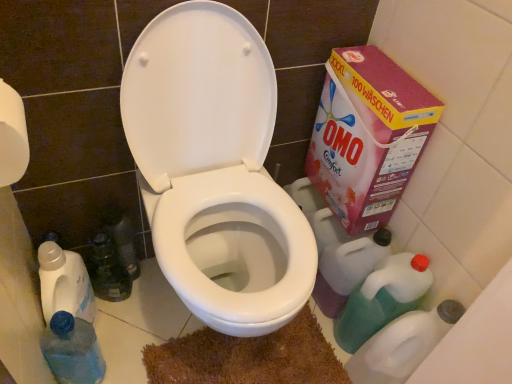
Question: Should I look upward or downward to see translucent plastic bottle at lower left?

Choices:
 (A) up
 (B) down

Answer: (B)

Question: Does green translucent bottle at lower right, the second cleaning product ordered from the bottom, come behind white glossy toilet at center?

Choices:
 (A) yes
 (B) no

Answer: (A)

Question: Is green translucent bottle at lower right, arranged as the first cleaning product when viewed from the top, outside of white glossy toilet at center?

Choices:
 (A) yes
 (B) no

Answer: (A)

Question: Is green translucent bottle at lower right, arranged as the first cleaning product when viewed from the top, smaller than white glossy toilet at center?

Choices:
 (A) no
 (B) yes

Answer: (B)

Question: From a real-world perspective, is green translucent bottle at lower right, the second cleaning product ordered from the bottom, over white glossy toilet at center?

Choices:
 (A) yes
 (B) no

Answer: (B)

Question: From the image's perspective, is green translucent bottle at lower right, the second cleaning product ordered from the bottom, over white glossy toilet at center?

Choices:
 (A) no
 (B) yes

Answer: (A)

Question: Is green translucent bottle at lower right, the second cleaning product ordered from the bottom, bigger than white glossy toilet at center?

Choices:
 (A) yes
 (B) no

Answer: (B)

Question: Is translucent plastic bottle at lower right, marked as the first cleaning product in a bottom-to-top arrangement, oriented away from pink cardboard box at right?

Choices:
 (A) yes
 (B) no

Answer: (B)

Question: Does translucent plastic bottle at lower right, placed as the 2th cleaning product when sorted from top to bottom, appear on the right side of pink cardboard box at right?

Choices:
 (A) no
 (B) yes

Answer: (B)

Question: Is translucent plastic bottle at lower right, marked as the first cleaning product in a bottom-to-top arrangement, positioned beyond the bounds of pink cardboard box at right?

Choices:
 (A) yes
 (B) no

Answer: (A)

Question: From the image's perspective, is translucent plastic bottle at lower right, marked as the first cleaning product in a bottom-to-top arrangement, under pink cardboard box at right?

Choices:
 (A) yes
 (B) no

Answer: (A)

Question: Considering the relative sizes of translucent plastic bottle at lower right, marked as the first cleaning product in a bottom-to-top arrangement, and pink cardboard box at right in the image provided, is translucent plastic bottle at lower right, marked as the first cleaning product in a bottom-to-top arrangement, smaller than pink cardboard box at right?

Choices:
 (A) yes
 (B) no

Answer: (A)

Question: Is translucent plastic bottle at lower right, placed as the 2th cleaning product when sorted from top to bottom, thinner than pink cardboard box at right?

Choices:
 (A) yes
 (B) no

Answer: (B)

Question: From the image's perspective, is white glossy toilet at center on pink cardboard box at right?

Choices:
 (A) no
 (B) yes

Answer: (A)